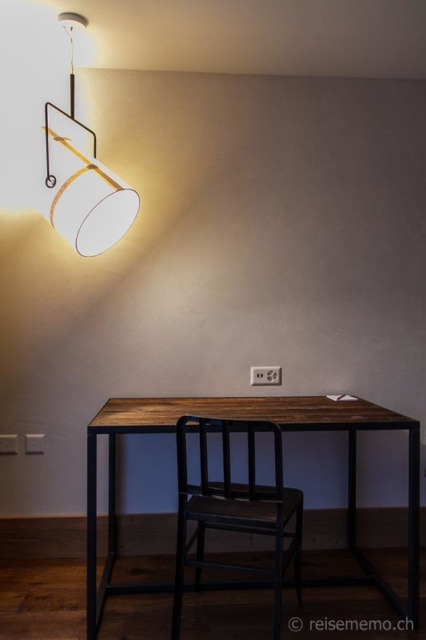
Question: Based on their relative distances, which object is nearer to the rustic wood table at center?

Choices:
 (A) matte white lampshade at upper left
 (B) black matte chair at center

Answer: (B)

Question: Among these objects, which one is nearest to the camera?

Choices:
 (A) rustic wood table at center
 (B) matte white lampshade at upper left
 (C) black matte chair at center

Answer: (C)

Question: Is rustic wood table at center behind black matte chair at center?

Choices:
 (A) no
 (B) yes

Answer: (B)

Question: Which of the following is the farthest from the observer?

Choices:
 (A) (350, 484)
 (B) (206, 426)
 (C) (118, 237)

Answer: (A)

Question: Does rustic wood table at center have a greater width compared to matte white lampshade at upper left?

Choices:
 (A) yes
 (B) no

Answer: (A)

Question: Is rustic wood table at center wider than black matte chair at center?

Choices:
 (A) yes
 (B) no

Answer: (A)